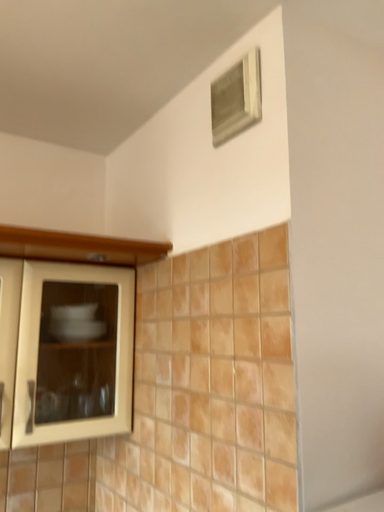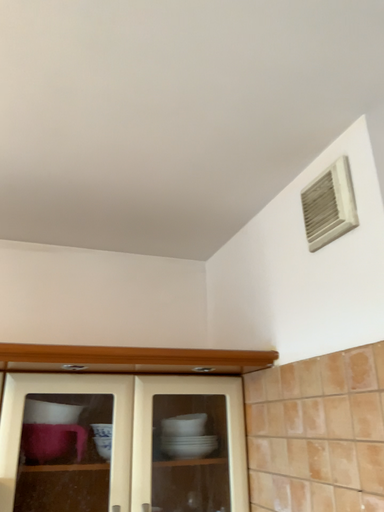
Question: How did the camera likely rotate when shooting the video?

Choices:
 (A) rotated downward
 (B) rotated upward

Answer: (B)